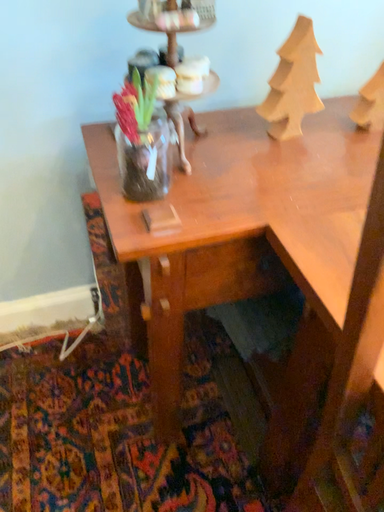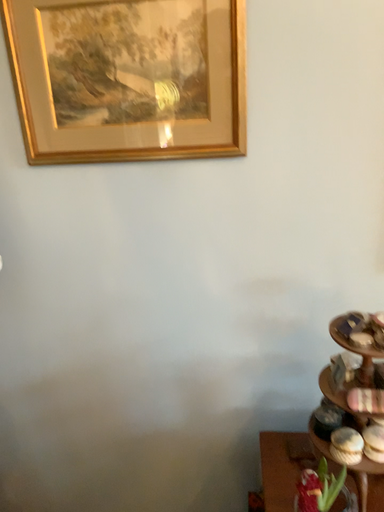
Question: How did the camera likely rotate when shooting the video?

Choices:
 (A) rotated downward
 (B) rotated upward

Answer: (B)